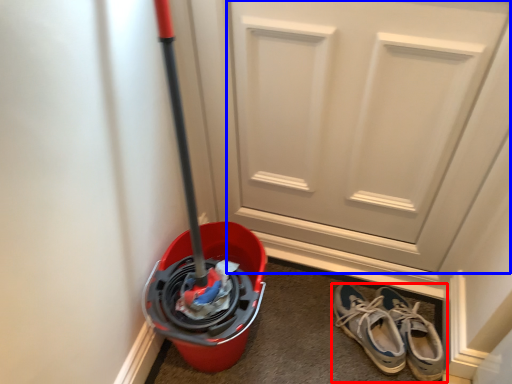
Question: Which object appears farthest to the camera in this image, footwear (highlighted by a red box) or door (highlighted by a blue box)?

Choices:
 (A) footwear
 (B) door

Answer: (A)